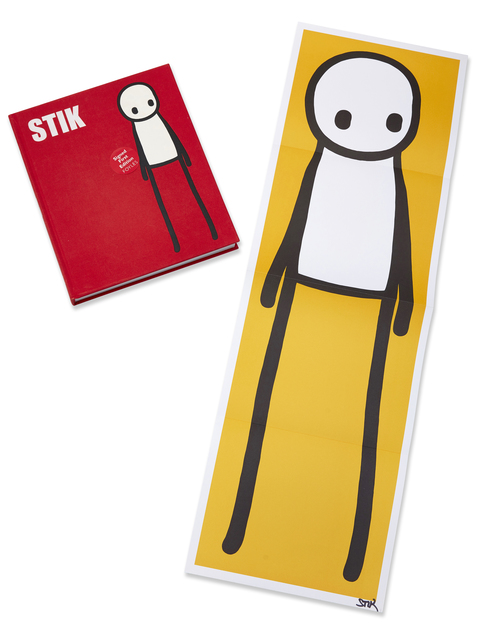
Locate an element on the screen. book is located at coordinates (119, 228).